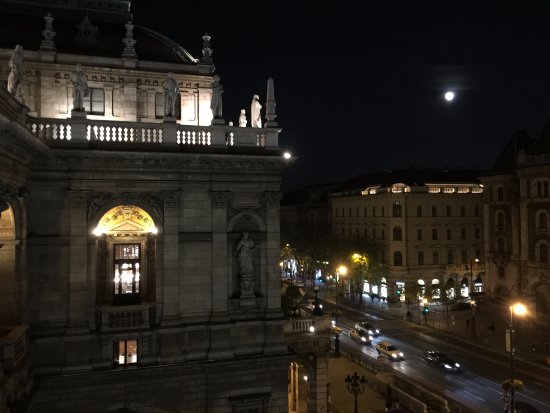
Identify the location of statue. (247, 246).